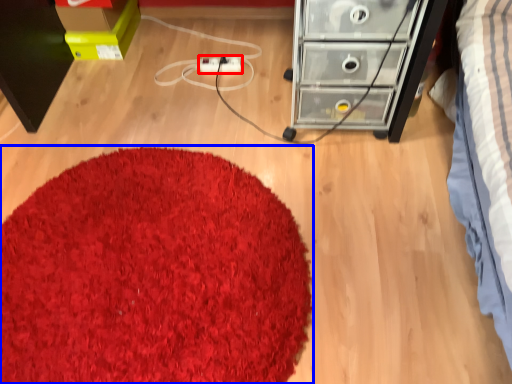
Question: Which object is closer to the camera taking this photo, extension cord (highlighted by a red box) or mat (highlighted by a blue box)?

Choices:
 (A) extension cord
 (B) mat

Answer: (B)